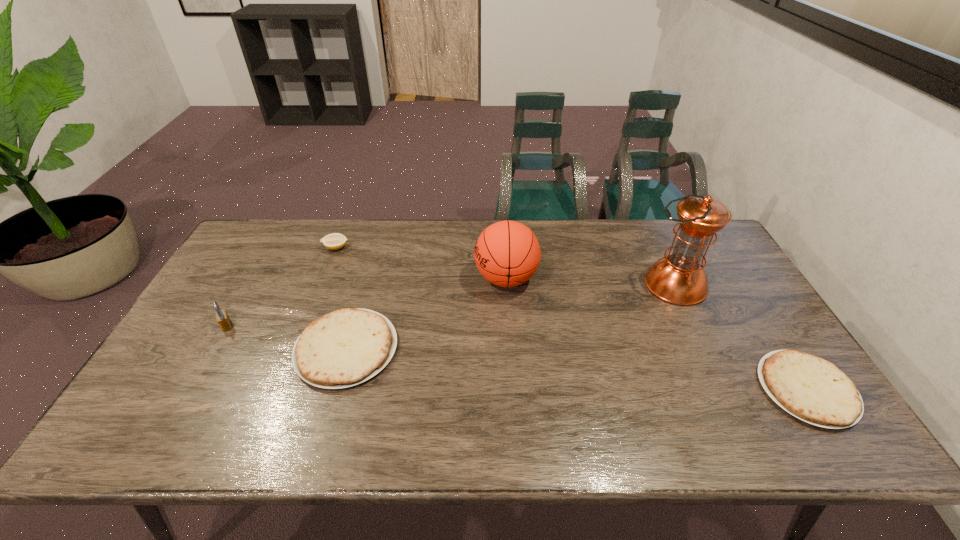
Identify the location of blank space that satisfies the following two spatial constraints: 1. on the front side of the shortest object; 2. on the left side of the oil lamp. (725, 389).